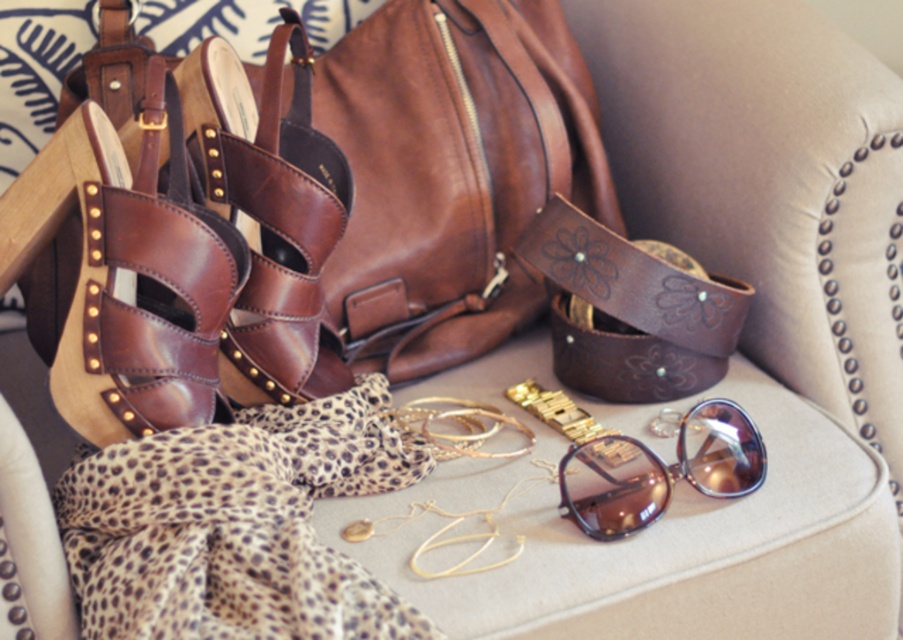
You are organizing a display of accessories on a chair. You have a brown leather bag at upper center and a shiny brown leather sandal at left. Which item is placed above the other?

The brown leather bag at upper center is positioned over shiny brown leather sandal at left, meaning it is placed above the sandal.

You are a delivery person who needs to pack the brown leather bag at upper center and the shiny purple sunglasses at center into a box. The box can only fit items where the larger item is at the bottom. Which item should you place at the bottom of the box?

The brown leather bag at upper center is larger in size than the shiny purple sunglasses at center, so you should place the brown leather bag at upper center at the bottom of the box.